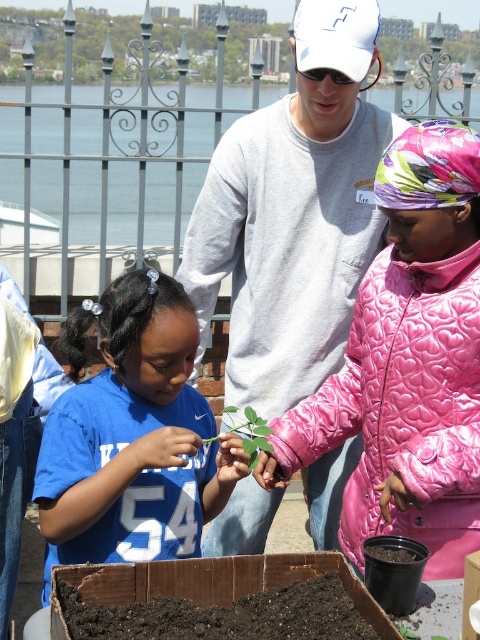
Question: Does gray sweatshirt at center appear over green matte leafy plant at center?

Choices:
 (A) no
 (B) yes

Answer: (B)

Question: Which object appears closest to the camera in this image?

Choices:
 (A) blue jersey at center
 (B) pink quilted jacket at center

Answer: (B)

Question: Is blue jersey at center above green matte leafy plant at center?

Choices:
 (A) yes
 (B) no

Answer: (B)

Question: Which object is closer to the camera taking this photo?

Choices:
 (A) gray sweatshirt at center
 (B) pink quilted jacket at center
 (C) blue jersey at center
 (D) green matte leafy plant at center

Answer: (B)

Question: Which point is closer to the camera?

Choices:
 (A) gray sweatshirt at center
 (B) green matte leafy plant at center

Answer: (B)

Question: Does gray sweatshirt at center have a smaller size compared to pink quilted jacket at center?

Choices:
 (A) no
 (B) yes

Answer: (A)